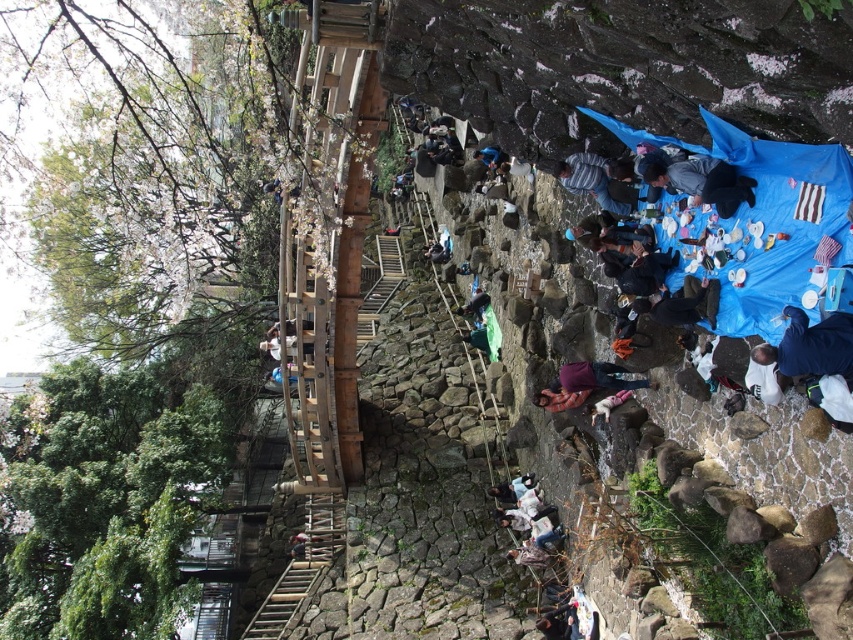
Does dark blue jacket at lower right have a smaller size compared to dark blue fabric at center?

Actually, dark blue jacket at lower right might be larger than dark blue fabric at center.

Is point (825, 323) positioned after point (718, 163)?

No, it is in front of (718, 163).

Describe the element at coordinates (810, 346) in the screenshot. Image resolution: width=853 pixels, height=640 pixels. I see `dark blue jacket at lower right` at that location.

Locate an element on the screen. The height and width of the screenshot is (640, 853). dark blue jacket at lower right is located at coordinates (810, 346).

Is wooden bridge at center smaller than dark blue jacket at lower right?

No, wooden bridge at center is not smaller than dark blue jacket at lower right.

This screenshot has height=640, width=853. Find the location of `wooden bridge at center`. wooden bridge at center is located at coordinates (323, 276).

Does dark blue jacket at lower right appear on the right side of purple fabric at center?

Indeed, dark blue jacket at lower right is positioned on the right side of purple fabric at center.

Is dark blue jacket at lower right in front of purple fabric at center?

Yes, dark blue jacket at lower right is in front of purple fabric at center.

The height and width of the screenshot is (640, 853). Describe the element at coordinates (810, 346) in the screenshot. I see `dark blue jacket at lower right` at that location.

Find the location of a particular element. The width and height of the screenshot is (853, 640). dark blue jacket at lower right is located at coordinates (810, 346).